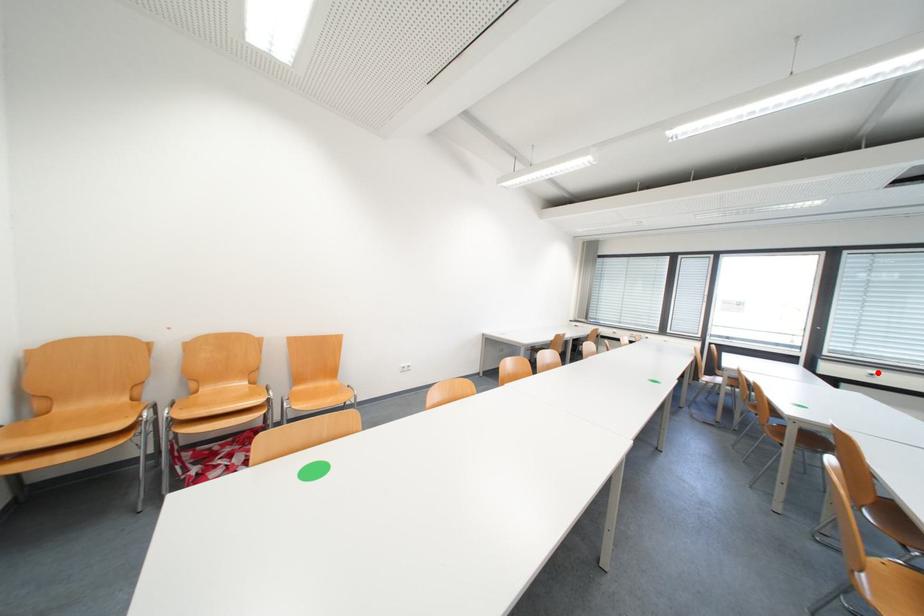
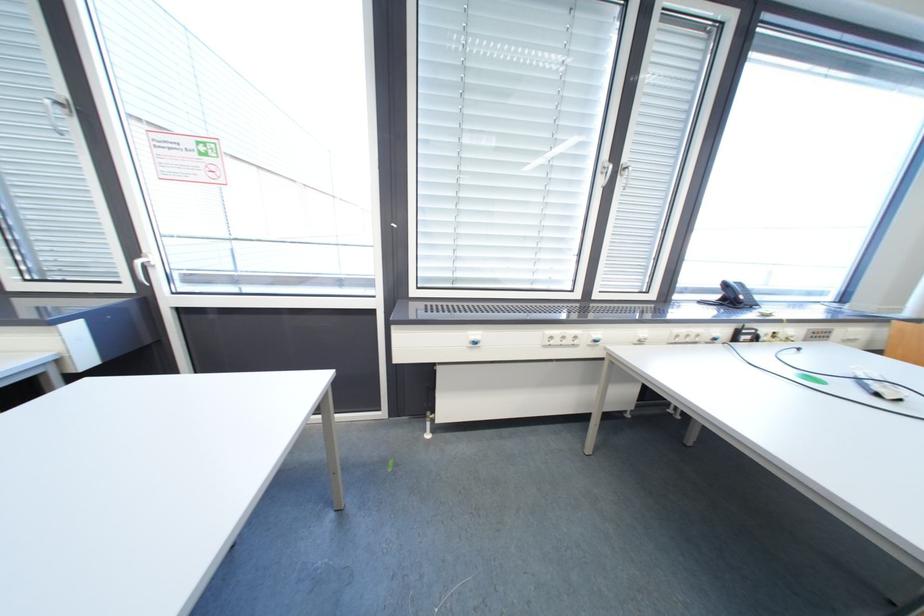
Locate, in the second image, the point that corresponds to the highlighted location in the first image.

(480, 334)